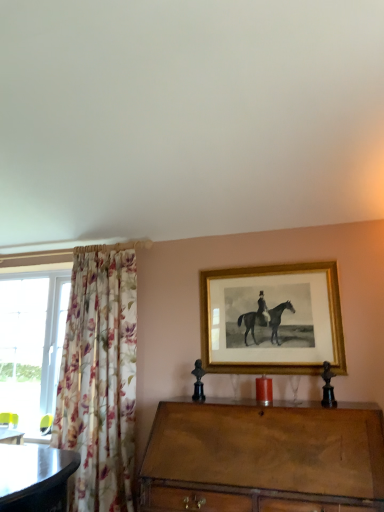
Locate an element on the screen. empty space that is ontop of gold/gilded picture frame at upper center (from a real-world perspective) is located at coordinates (271, 262).